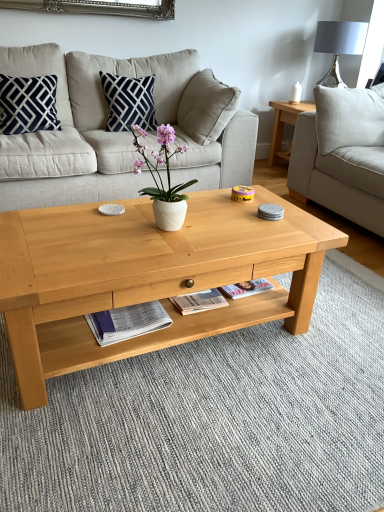
Question: From a real-world perspective, is navy blue velvet pillow at upper left, marked as the second pillow in a right-to-left arrangement, positioned above or below light gray fabric couch at right, the 1th studio couch from the right?

Choices:
 (A) above
 (B) below

Answer: (A)

Question: Is point (6, 123) positioned closer to the camera than point (350, 96)?

Choices:
 (A) farther
 (B) closer

Answer: (B)

Question: Which is farther from the beige fabric couch at center, the first studio couch from the left?

Choices:
 (A) natural wood coffee table at center
 (B) navy blue velvet pillow at upper left, marked as the second pillow in a right-to-left arrangement
 (C) white glossy magazine at lower center
 (D) navy blue fabric pillow at upper center, which ranks as the 2th pillow in left-to-right order
 (E) white matte vase at center

Answer: (C)

Question: Considering the real-world distances, which object is farthest from the natural wood coffee table at center?

Choices:
 (A) beige fabric couch at center, placed as the 2th studio couch when sorted from right to left
 (B) matte gray lampshade at upper right
 (C) navy blue fabric pillow at upper center, which ranks as the 2th pillow in left-to-right order
 (D) white matte vase at center
 (E) white glossy magazine at lower center

Answer: (B)